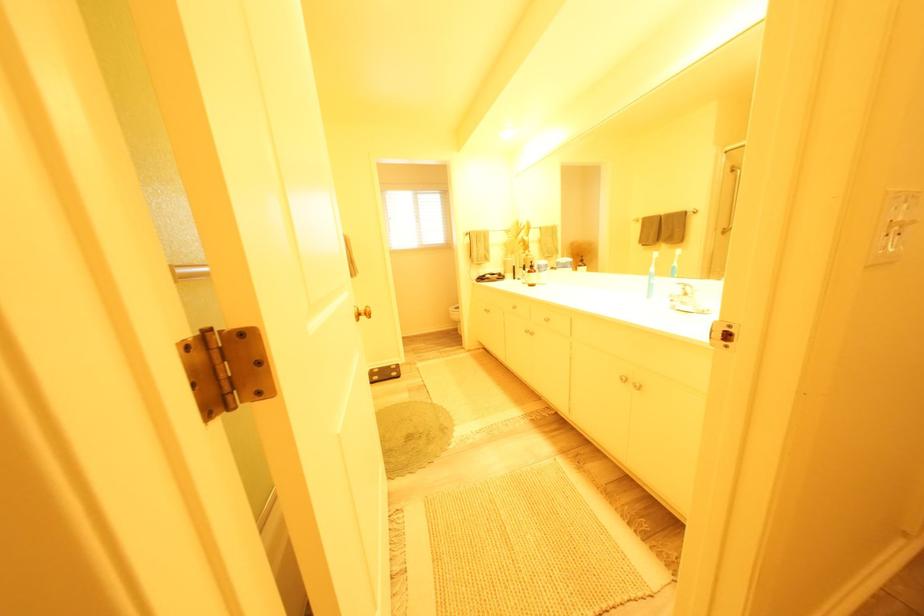
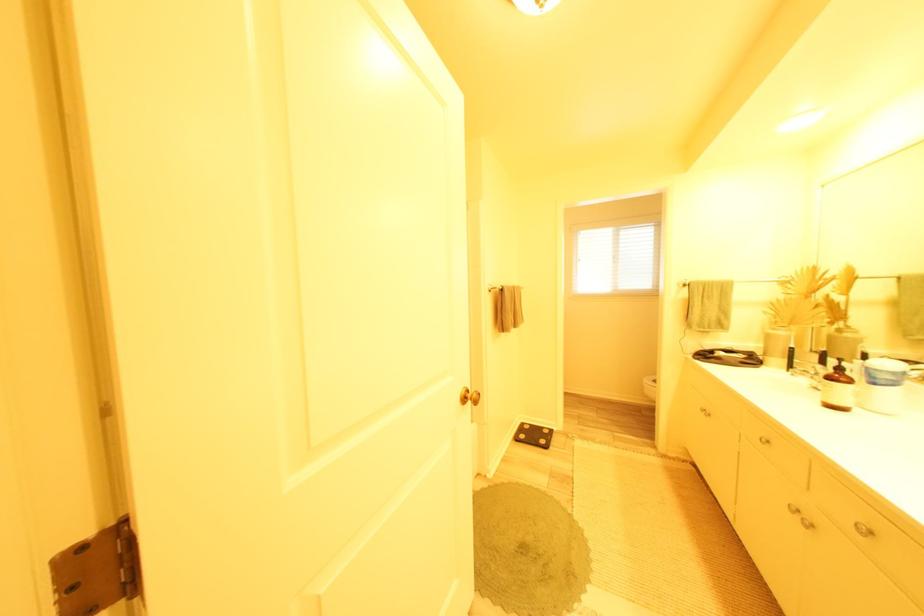
Find the pixel in the second image that matches the point at 550,268 in the first image.

(881, 373)